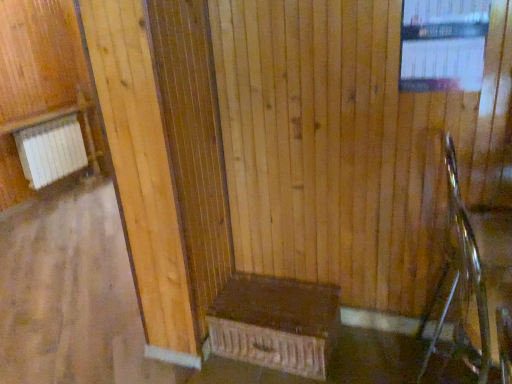
Question: Is transparent glass window at upper right bigger or smaller than dark brown wood bench at center?

Choices:
 (A) big
 (B) small

Answer: (B)

Question: Is transparent glass window at upper right to the left or to the right of dark brown wood bench at center in the image?

Choices:
 (A) left
 (B) right

Answer: (B)

Question: Estimate the real-world distances between objects in this image. Which object is closer to the transparent glass window at upper right?

Choices:
 (A) dark brown wood bench at center
 (B) metallic silver rocking chair at right

Answer: (B)

Question: Estimate the real-world distances between objects in this image. Which object is farther from the metallic silver rocking chair at right?

Choices:
 (A) transparent glass window at upper right
 (B) dark brown wood bench at center

Answer: (B)